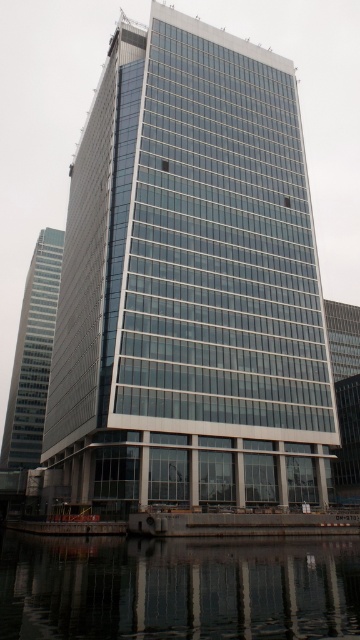
Is glassy steel tower at center in front of transparent glass water at lower center?

No, it is not.

Can you confirm if glassy steel tower at center is positioned to the left of transparent glass water at lower center?

Correct, you'll find glassy steel tower at center to the left of transparent glass water at lower center.

Who is more forward, [146,464] or [48,628]?

Point [48,628] is in front.

I want to click on glassy steel tower at center, so click(x=191, y=284).

Can you confirm if transparent glass water at lower center is wider than glassy reflective skyscraper at left?

Indeed, transparent glass water at lower center has a greater width compared to glassy reflective skyscraper at left.

Image resolution: width=360 pixels, height=640 pixels. Describe the element at coordinates (177, 588) in the screenshot. I see `transparent glass water at lower center` at that location.

I want to click on transparent glass water at lower center, so click(177, 588).

Describe the element at coordinates (191, 284) in the screenshot. The width and height of the screenshot is (360, 640). I see `glassy steel tower at center` at that location.

The height and width of the screenshot is (640, 360). What are the coordinates of `glassy steel tower at center` in the screenshot? It's located at (191, 284).

The image size is (360, 640). I want to click on glassy steel tower at center, so click(191, 284).